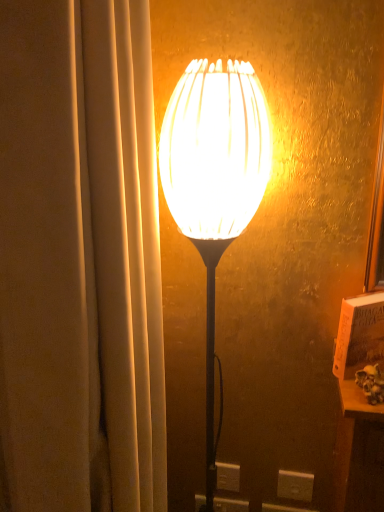
Question: From a real-world perspective, is white plastic electric outlet at lower center physically located above or below white matte lampshade at center?

Choices:
 (A) below
 (B) above

Answer: (A)

Question: Is white plastic electric outlet at lower center to the left or to the right of white matte lampshade at center in the image?

Choices:
 (A) right
 (B) left

Answer: (A)

Question: Considering their positions, is white plastic electric outlet at lower center located in front of or behind white matte lampshade at center?

Choices:
 (A) front
 (B) behind

Answer: (B)

Question: Is white matte lampshade at center bigger or smaller than white plastic electric outlet at lower center?

Choices:
 (A) small
 (B) big

Answer: (B)

Question: Is white matte lampshade at center inside or outside of white plastic electric outlet at lower center?

Choices:
 (A) inside
 (B) outside

Answer: (B)

Question: Is white matte lampshade at center in front of or behind white plastic electric outlet at lower center in the image?

Choices:
 (A) behind
 (B) front

Answer: (B)

Question: Is point (258, 203) positioned closer to the camera than point (304, 477)?

Choices:
 (A) closer
 (B) farther

Answer: (A)